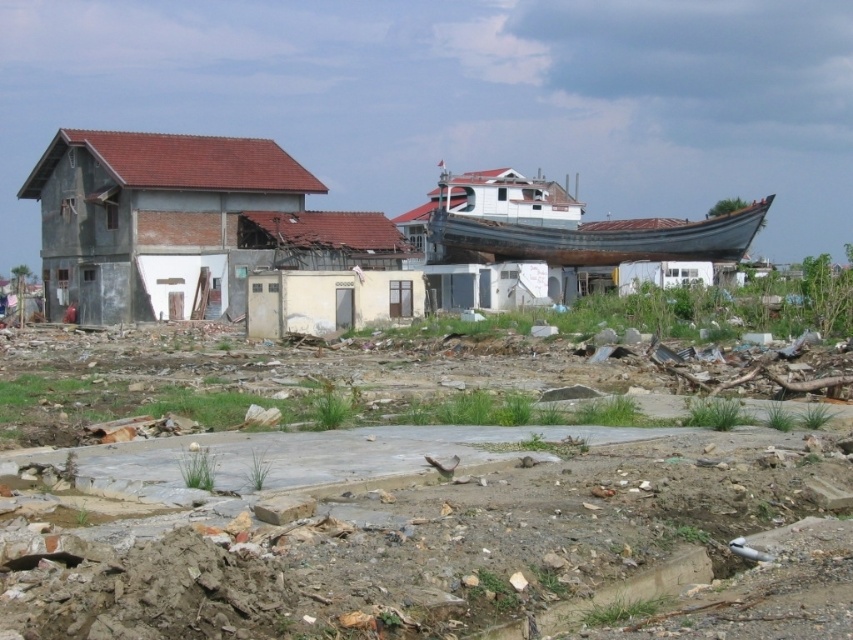
You are a rescue worker needing to reach the rusty metal boat at center from the gray concrete house at left to check for survivors. Considering the terrain described in the scene, can you safely walk directly between them without any obstacles?

The distance between the gray concrete house at left and the rusty metal boat at center is 14.85 meters. However, the terrain is littered with debris, broken concrete slabs, and scattered rubble, making it unsafe to walk directly between them without potential obstacles.

You are a rescue worker using a drone to survey the disaster area. The drone has a maximum flight range of 60 meters. You need to inspect the gray concrete house at left. Can the drone reach it without exceeding its range?

The gray concrete house at left is 59.28 meters away from the camera, so the drone can reach it since its maximum range is 60 meters.

You are a rescue worker assessing the area. You need to determine which object is higher in elevation between the gray concrete house at left and the rusty metal boat at center. Which one is taller?

The gray concrete house at left is taller than the rusty metal boat at center.